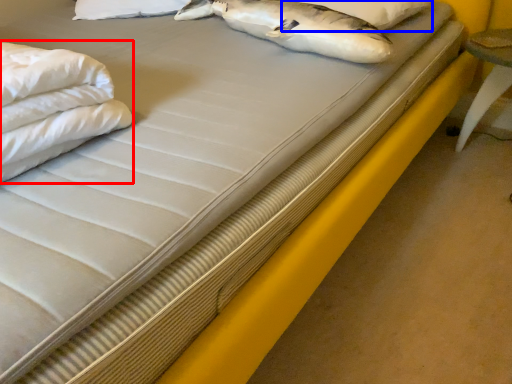
Question: Which of the following is the farthest to the observer, sheet (highlighted by a red box) or pillow (highlighted by a blue box)?

Choices:
 (A) sheet
 (B) pillow

Answer: (B)